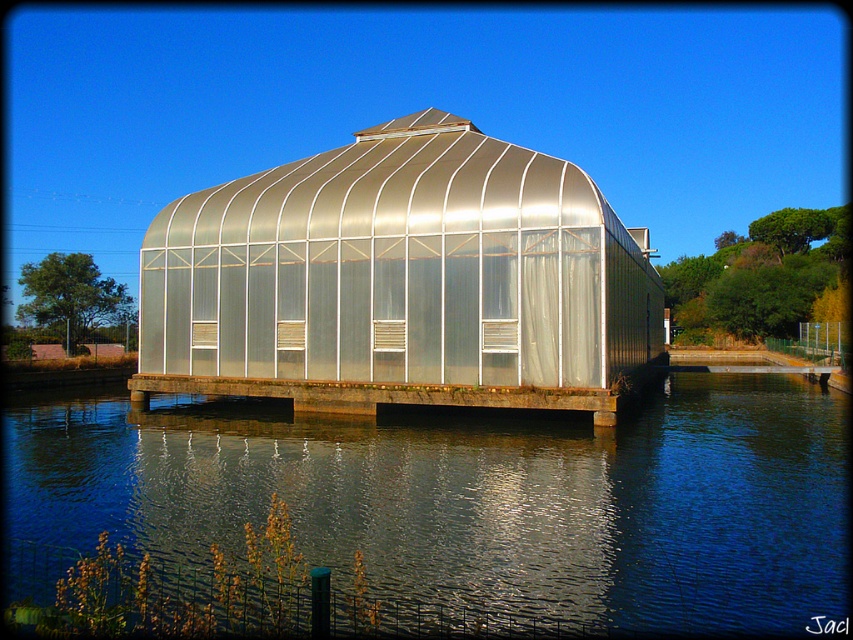
Question: Which point is closer to the camera taking this photo?

Choices:
 (A) (631, 358)
 (B) (282, 397)

Answer: (B)

Question: Does transparent water at center lie behind metallic concrete dock at center?

Choices:
 (A) yes
 (B) no

Answer: (B)

Question: Does transparent glass greenhouse at center appear on the left side of metallic concrete dock at center?

Choices:
 (A) yes
 (B) no

Answer: (B)

Question: Which point appears farthest from the camera in this image?

Choices:
 (A) (611, 314)
 (B) (405, 449)

Answer: (A)

Question: Which point is closer to the camera taking this photo?

Choices:
 (A) (437, 211)
 (B) (845, 570)
 (C) (397, 384)

Answer: (B)

Question: Is transparent glass greenhouse at center thinner than metallic concrete dock at center?

Choices:
 (A) yes
 (B) no

Answer: (B)